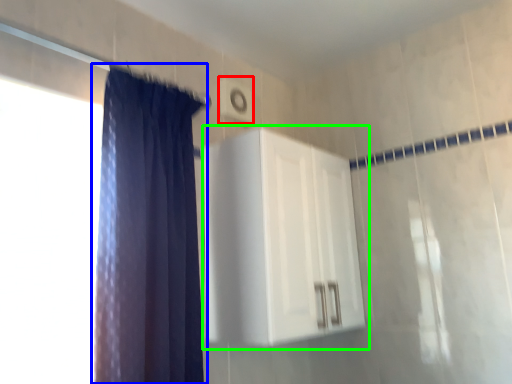
Question: Estimate the real-world distances between objects in this image. Which object is farther from light switch (highlighted by a red box), curtain (highlighted by a blue box) or dresser (highlighted by a green box)?

Choices:
 (A) curtain
 (B) dresser

Answer: (A)